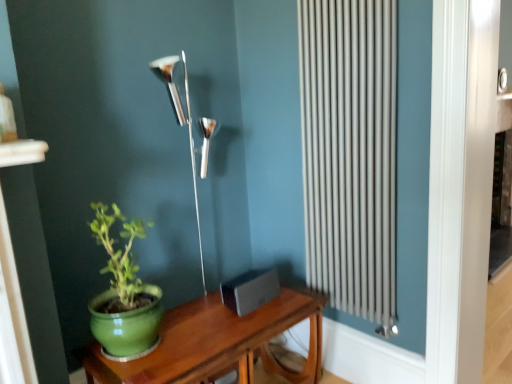
Question: Is green matte pot at left behind polished silver lamp at center?

Choices:
 (A) no
 (B) yes

Answer: (A)

Question: From the image's perspective, is green matte pot at left on polished silver lamp at center?

Choices:
 (A) no
 (B) yes

Answer: (A)

Question: Does green matte pot at left contain polished silver lamp at center?

Choices:
 (A) no
 (B) yes

Answer: (A)

Question: Considering the relative sizes of green matte pot at left and polished silver lamp at center in the image provided, is green matte pot at left bigger than polished silver lamp at center?

Choices:
 (A) yes
 (B) no

Answer: (B)

Question: From a real-world perspective, is green matte pot at left on polished silver lamp at center?

Choices:
 (A) yes
 (B) no

Answer: (B)

Question: In terms of width, does silver metallic radiator at right look wider or thinner when compared to green wood table at lower left?

Choices:
 (A) thin
 (B) wide

Answer: (A)

Question: Is silver metallic radiator at right bigger or smaller than green wood table at lower left?

Choices:
 (A) big
 (B) small

Answer: (B)

Question: Considering the positions of point (349, 284) and point (261, 344), is point (349, 284) closer or farther from the camera than point (261, 344)?

Choices:
 (A) farther
 (B) closer

Answer: (A)

Question: Is silver metallic radiator at right taller or shorter than green wood table at lower left?

Choices:
 (A) short
 (B) tall

Answer: (B)

Question: Would you say green wood table at lower left is to the left or to the right of silver metallic radiator at right in the picture?

Choices:
 (A) right
 (B) left

Answer: (B)

Question: Considering their positions, is green wood table at lower left located in front of or behind silver metallic radiator at right?

Choices:
 (A) front
 (B) behind

Answer: (A)

Question: Considering the positions of green wood table at lower left and silver metallic radiator at right in the image, is green wood table at lower left bigger or smaller than silver metallic radiator at right?

Choices:
 (A) small
 (B) big

Answer: (B)

Question: In terms of height, does green wood table at lower left look taller or shorter compared to silver metallic radiator at right?

Choices:
 (A) short
 (B) tall

Answer: (A)

Question: Based on their sizes in the image, would you say silver metallic radiator at right is bigger or smaller than polished silver lamp at center?

Choices:
 (A) small
 (B) big

Answer: (A)

Question: Based on their positions, is silver metallic radiator at right located to the left or right of polished silver lamp at center?

Choices:
 (A) left
 (B) right

Answer: (B)